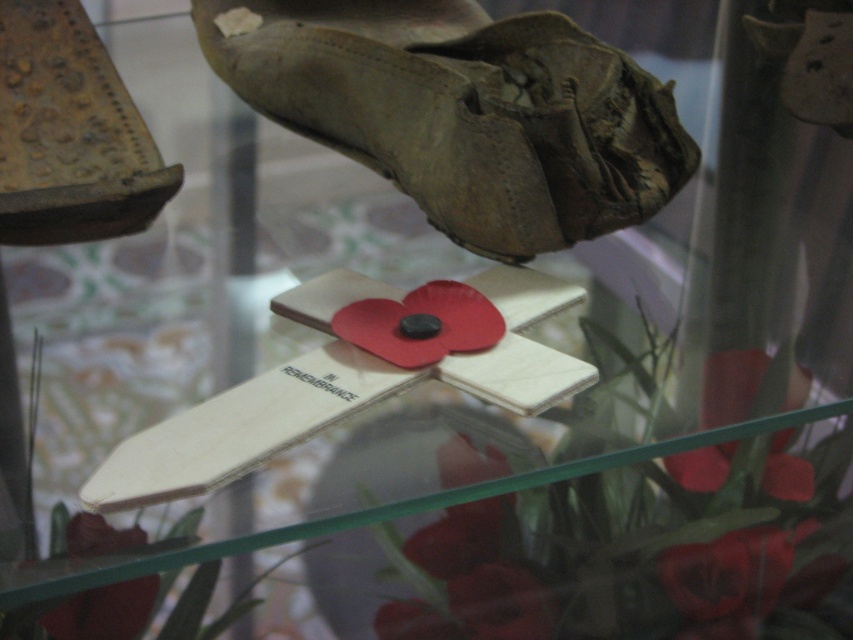
Does leather shoe at upper center have a lesser width compared to rusty metal shoe at upper left?

In fact, leather shoe at upper center might be wider than rusty metal shoe at upper left.

Does leather shoe at upper center appear over rusty metal shoe at upper left?

Yes, leather shoe at upper center is above rusty metal shoe at upper left.

Is point (665, 147) farther from camera compared to point (144, 170)?

That is True.

The width and height of the screenshot is (853, 640). I want to click on leather shoe at upper center, so click(x=465, y=113).

Can you confirm if leather shoe at upper center is positioned above wooden cross at center?

Indeed, leather shoe at upper center is positioned over wooden cross at center.

Which is in front, point (267, 4) or point (321, 356)?

Point (321, 356)

The height and width of the screenshot is (640, 853). I want to click on leather shoe at upper center, so click(x=465, y=113).

Identify the location of wooden cross at center. The width and height of the screenshot is (853, 640). (239, 428).

Is wooden cross at center behind matte red poppy at lower center?

That is True.

Which is behind, point (349, 388) or point (57, 637)?

The point (57, 637) is more distant.

Identify the location of wooden cross at center. (239, 428).